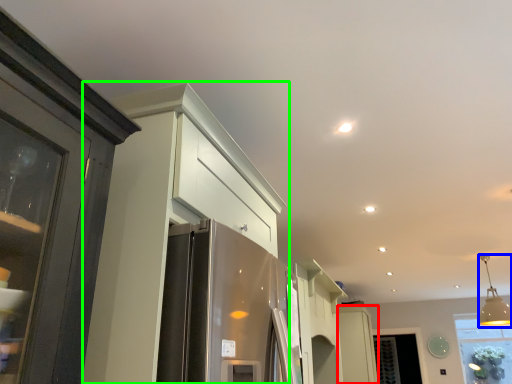
Question: Which is nearer to the cabinetry (highlighted by a red box)? light fixture (highlighted by a blue box) or cabinetry (highlighted by a green box).

Choices:
 (A) light fixture
 (B) cabinetry

Answer: (A)